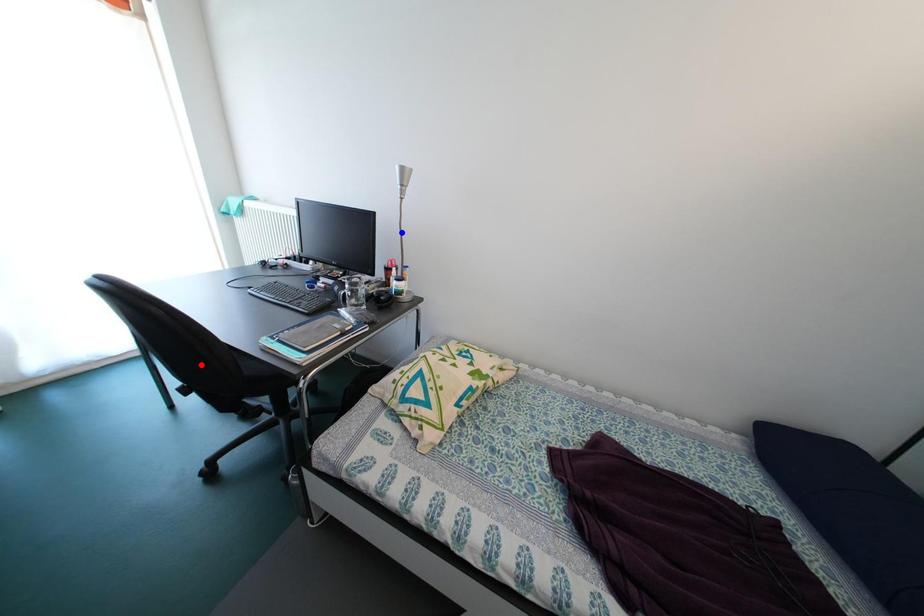
Question: In the image, two points are highlighted. Which point is nearer to the camera? Reply with the corresponding letter.

Choices:
 (A) blue point
 (B) red point

Answer: (B)